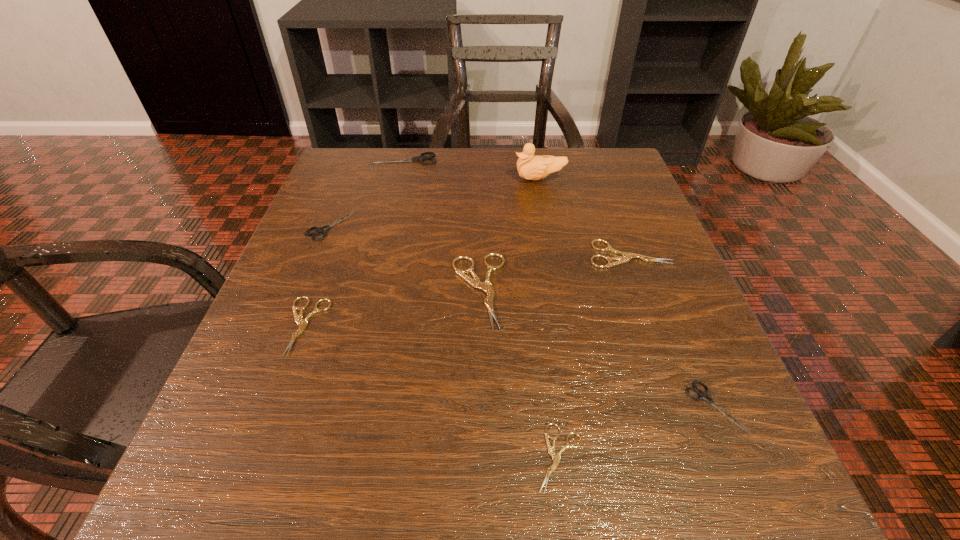
Identify which black shears is the closest to the shortest shears. Please provide its 2D coordinates. Your answer should be formatted as a tuple, i.e. [(x, y)], where the tuple contains the x and y coordinates of a point satisfying the conditions above.

[(702, 395)]

This screenshot has width=960, height=540. I want to click on the fourth closest beige shears relative to the nearest black shears, so click(x=302, y=323).

Identify the location of beige shears that is the second closest to the second biggest beige shears. (556, 457).

This screenshot has height=540, width=960. Identify the location of vacant area in the image that satisfies the following two spatial constraints: 1. on the front side of the fourth object from left to right; 2. on the right side of the farthest object. point(373,290).

Locate an element on the screen. The width and height of the screenshot is (960, 540). free point that satisfies the following two spatial constraints: 1. on the back side of the biggest black shears; 2. on the left side of the third biggest beige shears is located at coordinates coord(366,160).

This screenshot has height=540, width=960. What are the coordinates of `vacant position in the image that satisfies the following two spatial constraints: 1. on the face of the second biggest beige shears; 2. on the left side of the duckling` in the screenshot? It's located at (554, 254).